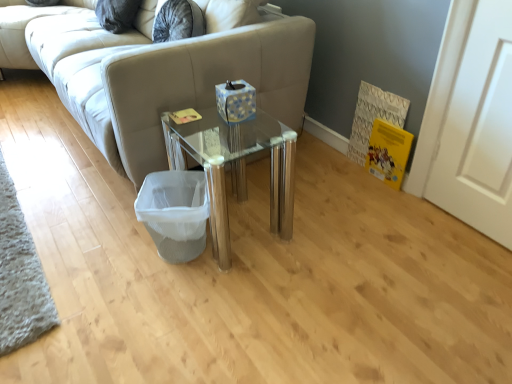
Question: Can transparent glass table at center be found inside white mesh laundry basket at lower center?

Choices:
 (A) no
 (B) yes

Answer: (A)

Question: Can you confirm if white mesh laundry basket at lower center is positioned to the left of transparent glass table at center?

Choices:
 (A) yes
 (B) no

Answer: (A)

Question: Does white mesh laundry basket at lower center have a greater width compared to transparent glass table at center?

Choices:
 (A) no
 (B) yes

Answer: (A)

Question: Considering the relative sizes of white mesh laundry basket at lower center and transparent glass table at center in the image provided, is white mesh laundry basket at lower center bigger than transparent glass table at center?

Choices:
 (A) yes
 (B) no

Answer: (B)

Question: Considering the relative sizes of white mesh laundry basket at lower center and transparent glass table at center in the image provided, is white mesh laundry basket at lower center thinner than transparent glass table at center?

Choices:
 (A) no
 (B) yes

Answer: (B)

Question: From the image's perspective, is beige fabric studio couch at center above or below transparent glass table at center?

Choices:
 (A) below
 (B) above

Answer: (B)

Question: From a real-world perspective, is beige fabric studio couch at center above or below transparent glass table at center?

Choices:
 (A) below
 (B) above

Answer: (B)

Question: In terms of size, does beige fabric studio couch at center appear bigger or smaller than transparent glass table at center?

Choices:
 (A) small
 (B) big

Answer: (B)

Question: Is beige fabric studio couch at center spatially inside transparent glass table at center, or outside of it?

Choices:
 (A) inside
 (B) outside

Answer: (B)

Question: Is transparent glass table at center bigger or smaller than beige fabric studio couch at center?

Choices:
 (A) small
 (B) big

Answer: (A)

Question: From a real-world perspective, is transparent glass table at center positioned above or below beige fabric studio couch at center?

Choices:
 (A) below
 (B) above

Answer: (A)

Question: Which is correct: transparent glass table at center is inside beige fabric studio couch at center, or outside of it?

Choices:
 (A) outside
 (B) inside

Answer: (A)

Question: Looking at their shapes, would you say transparent glass table at center is wider or thinner than beige fabric studio couch at center?

Choices:
 (A) wide
 (B) thin

Answer: (B)

Question: Is white mesh laundry basket at lower center spatially inside transparent glass table at center, or outside of it?

Choices:
 (A) inside
 (B) outside

Answer: (A)

Question: Is white mesh laundry basket at lower center bigger or smaller than transparent glass table at center?

Choices:
 (A) small
 (B) big

Answer: (A)